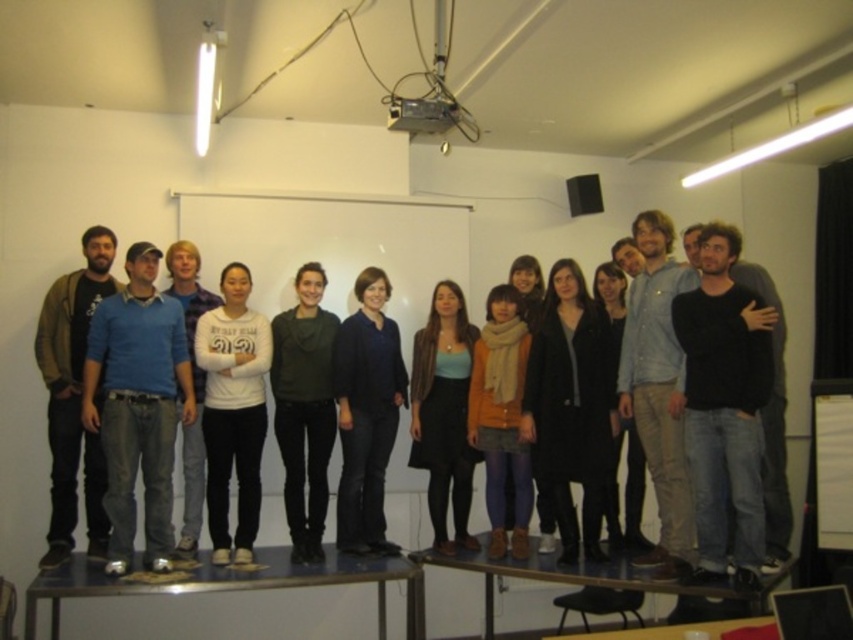
Is point (566, 545) more distant than point (526, 444)?

No, it is not.

Who is taller, black wool coat at center or orange sweater at center?

With more height is black wool coat at center.

Describe the element at coordinates (570, 406) in the screenshot. I see `black wool coat at center` at that location.

Find the location of `black wool coat at center`. black wool coat at center is located at coordinates (570, 406).

Which is below, blue denim shirt at right or matte black dress at center?

matte black dress at center is lower down.

Locate an element on the screen. blue denim shirt at right is located at coordinates (659, 388).

Does point (635, 564) come closer to viewer compared to point (468, 365)?

Yes, point (635, 564) is closer to viewer.

Identify the location of blue denim shirt at right. Image resolution: width=853 pixels, height=640 pixels. click(x=659, y=388).

Based on the photo, between black wool coat at center and dark brown leather jacket at left, which one is positioned higher?

dark brown leather jacket at left is higher up.

Who is lower down, black wool coat at center or dark brown leather jacket at left?

Positioned lower is black wool coat at center.

I want to click on black wool coat at center, so click(570, 406).

What are the coordinates of `black wool coat at center` in the screenshot? It's located at (570, 406).